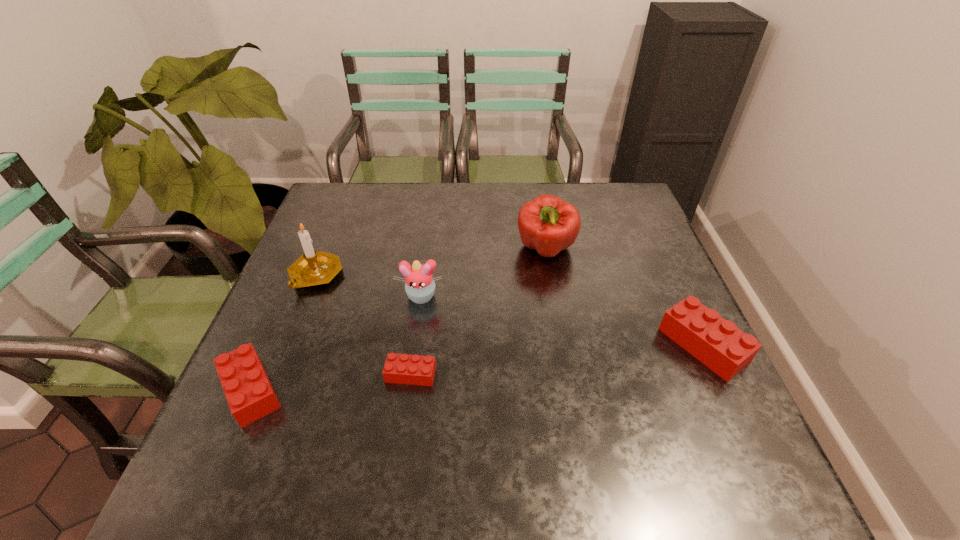
You are a GUI agent. You are given a task and a screenshot of the screen. Output one action in this format:
    pyautogui.click(x=<x>, y=<y>)
    Task: Click on the leftmost Lego
    The width and height of the screenshot is (960, 540).
    Given the screenshot: What is the action you would take?
    pyautogui.click(x=250, y=396)

The image size is (960, 540). What are the coordinates of `the second shortest object` in the screenshot? It's located at (250, 396).

You are a GUI agent. You are given a task and a screenshot of the screen. Output one action in this format:
    pyautogui.click(x=<x>, y=<y>)
    Task: Click on the shortest object
    The image size is (960, 540).
    Given the screenshot: What is the action you would take?
    pyautogui.click(x=399, y=368)

Identify the location of the shortest Lego. The width and height of the screenshot is (960, 540). (399, 368).

Identify the location of the rightmost Lego. Image resolution: width=960 pixels, height=540 pixels. (717, 343).

You are a GUI agent. You are given a task and a screenshot of the screen. Output one action in this format:
    pyautogui.click(x=<x>, y=<y>)
    Task: Click on the cupcake
    The height and width of the screenshot is (540, 960).
    Given the screenshot: What is the action you would take?
    pyautogui.click(x=419, y=285)

Image resolution: width=960 pixels, height=540 pixels. In order to click on bell pepper in this screenshot , I will do `click(547, 224)`.

You are a GUI agent. You are given a task and a screenshot of the screen. Output one action in this format:
    pyautogui.click(x=<x>, y=<y>)
    Task: Click on the candle holder
    
    Given the screenshot: What is the action you would take?
    pyautogui.click(x=312, y=268)

The image size is (960, 540). In order to click on vacant point located 0.300m on the right of the second shortest object in this screenshot , I will do `click(435, 390)`.

You are a GUI agent. You are given a task and a screenshot of the screen. Output one action in this format:
    pyautogui.click(x=<x>, y=<y>)
    Task: Click on the free spot located 0.080m on the left of the second Lego from left to right
    
    Given the screenshot: What is the action you would take?
    pyautogui.click(x=348, y=374)